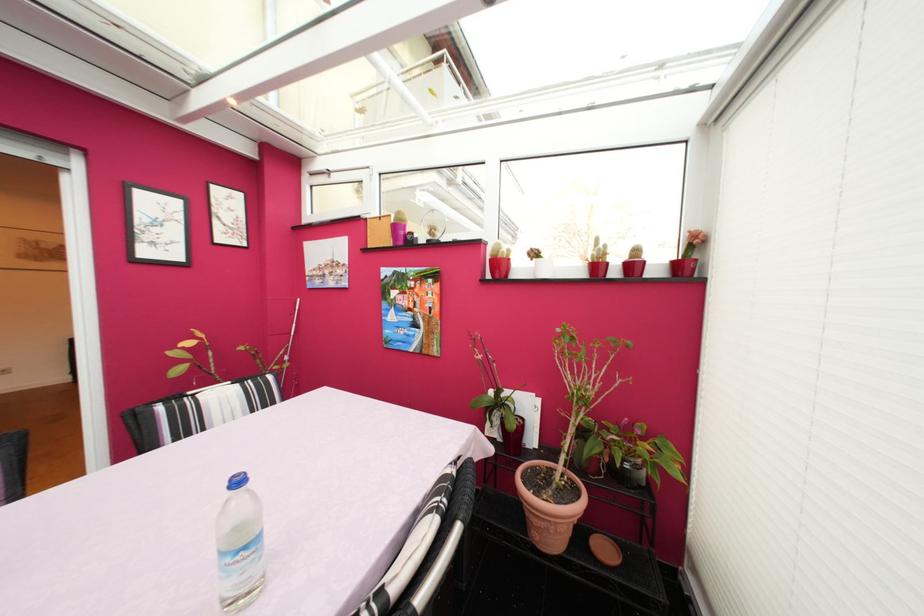
Which object does [549,508] point to?

It corresponds to the terracotta plant pot in the image.